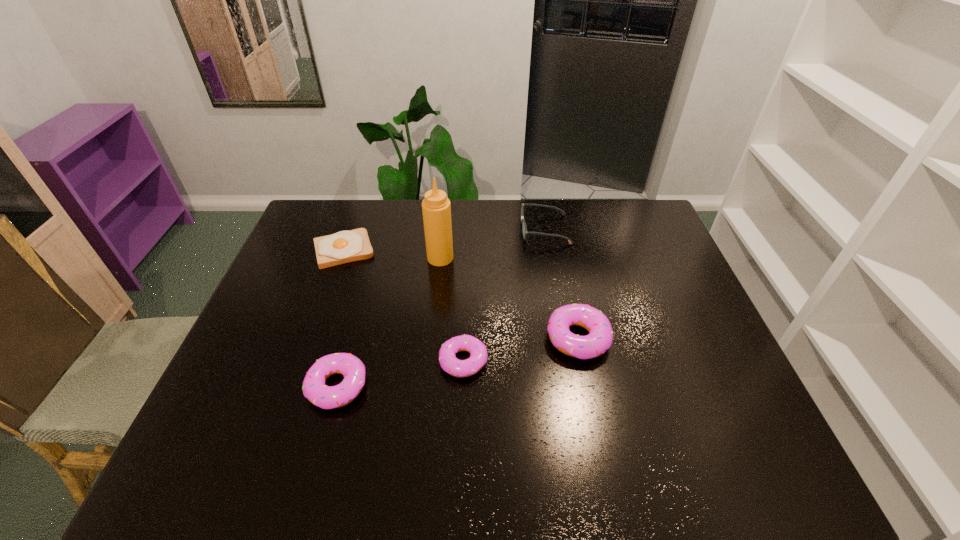
Find the location of a particular element. The width and height of the screenshot is (960, 540). free spot between the shortest doughnut and the condiment is located at coordinates (452, 309).

This screenshot has width=960, height=540. What are the coordinates of `free spot between the spectacles and the rightmost doughnut` in the screenshot? It's located at (562, 284).

Find the location of `free spot between the spectacles and the condiment`. free spot between the spectacles and the condiment is located at coordinates (492, 244).

The width and height of the screenshot is (960, 540). I want to click on unoccupied area between the second doughnut from left to right and the spectacles, so click(x=504, y=295).

Select which object is the second closest to the second shortest doughnut. Please provide its 2D coordinates. Your answer should be formatted as a tuple, i.e. [(x, y)], where the tuple contains the x and y coordinates of a point satisfying the conditions above.

[(346, 246)]

This screenshot has width=960, height=540. I want to click on object that is the closest to the spectacles, so click(x=436, y=208).

The width and height of the screenshot is (960, 540). I want to click on doughnut object that ranks as the second closest to the spectacles, so click(478, 357).

What are the coordinates of `doughnut that is the closest to the leftmost doughnut` in the screenshot? It's located at [478, 357].

Locate an element on the screen. Image resolution: width=960 pixels, height=540 pixels. vacant space that satisfies the following two spatial constraints: 1. on the face of the spectacles; 2. on the front side of the shortest doughnut is located at coordinates (567, 361).

I want to click on blank area in the image that satisfies the following two spatial constraints: 1. on the back side of the leftmost doughnut; 2. on the left side of the rightmost doughnut, so click(x=350, y=338).